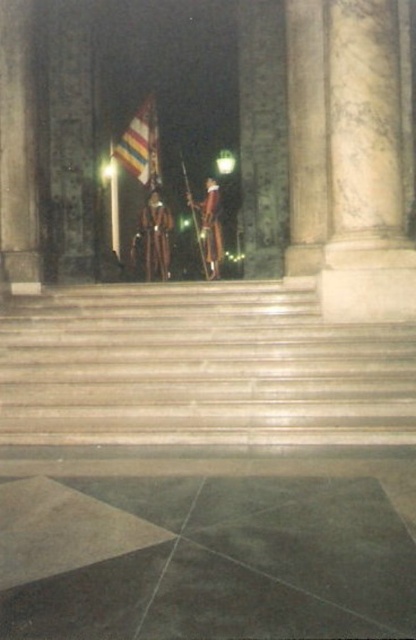
Question: Can you confirm if striped fabric flag at center is positioned above shiny gold helmet at center?

Choices:
 (A) yes
 (B) no

Answer: (A)

Question: Which point is farther to the camera?

Choices:
 (A) (156, 173)
 (B) (341, 440)
 (C) (205, 209)

Answer: (A)

Question: Can you confirm if striped fabric flag at center is bigger than shiny gold helmet at center?

Choices:
 (A) yes
 (B) no

Answer: (A)

Question: Can you confirm if striped fabric flag at center is wider than shiny gold uniform at center?

Choices:
 (A) yes
 (B) no

Answer: (A)

Question: Which of the following is the closest to the observer?

Choices:
 (A) (138, 112)
 (B) (289, 433)

Answer: (B)

Question: Estimate the real-world distances between objects in this image. Which object is closer to the shiny gold helmet at center?

Choices:
 (A) smooth stone stairs at center
 (B) striped fabric flag at center
 (C) shiny gold uniform at center

Answer: (C)